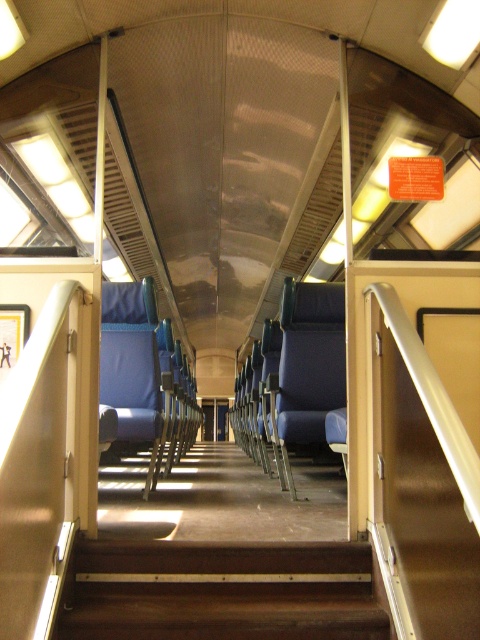
You are a passenger standing in the aisle of the train carriage and want to sit down. You notice a blue fabric seat at center and a matte blue seat at center. Which seat is closer to you?

The blue fabric seat at center is closer to you because it is further to the viewer than the matte blue seat at center.

You are standing at the back of the train carriage and want to exit through the front door. You see the brown wooden stairs at center. In which direction should you move relative to the stairs to reach the front door?

To reach the front door from the back of the train carriage, you should move forward towards the brown wooden stairs at center since they are centrally located and likely lead to the front exit.